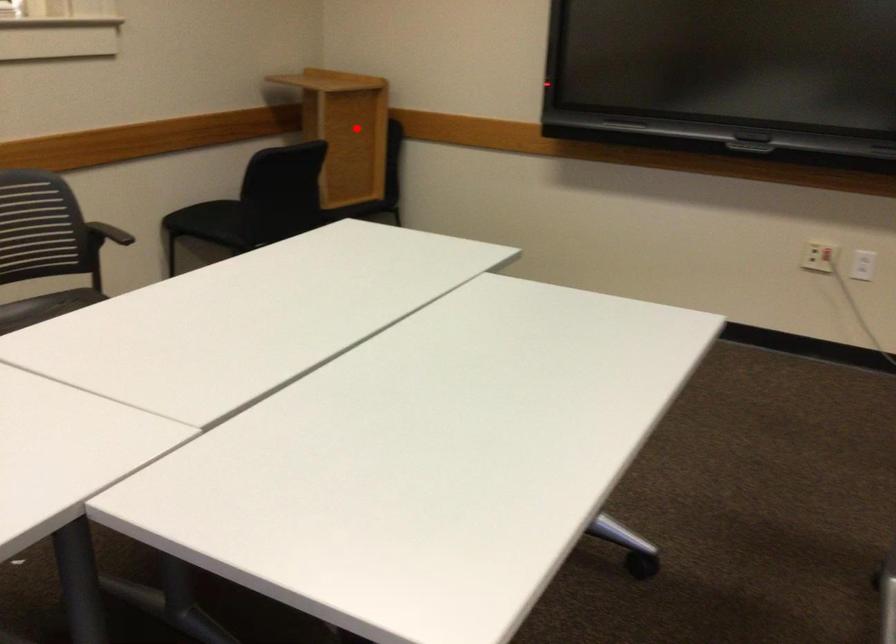
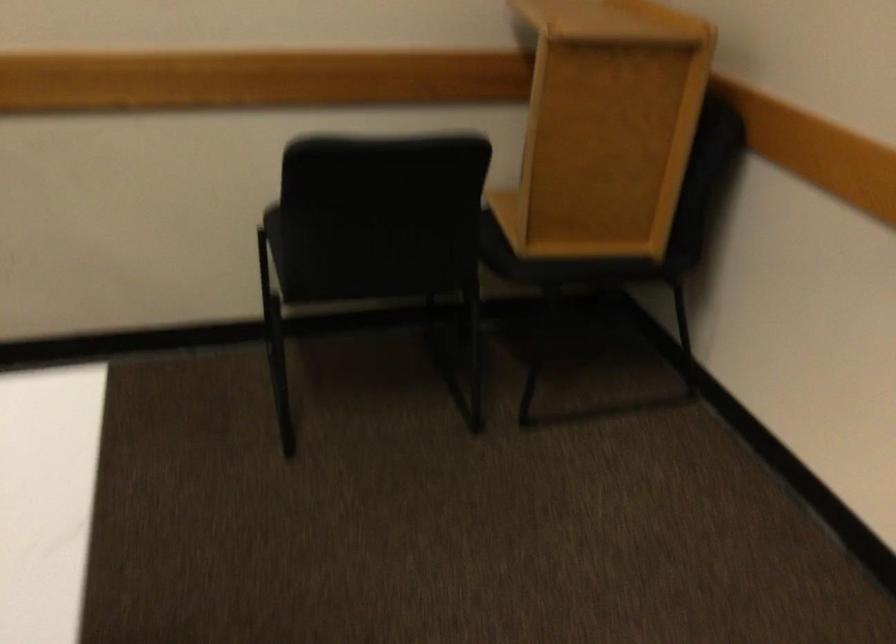
In the second image, find the point that corresponds to the highlighted location in the first image.

(605, 127)